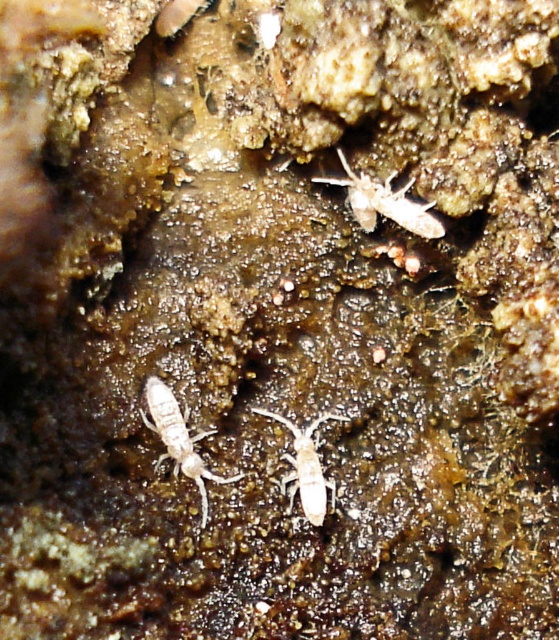
You are an entomologist observing the textured surface. You notice two insects labeled as white matte insect at lower left and white matte insect at center. Which insect is located closer to the bottom edge of the surface?

The white matte insect at lower left is positioned over the white matte insect at center, meaning it is closer to the bottom edge of the surface.